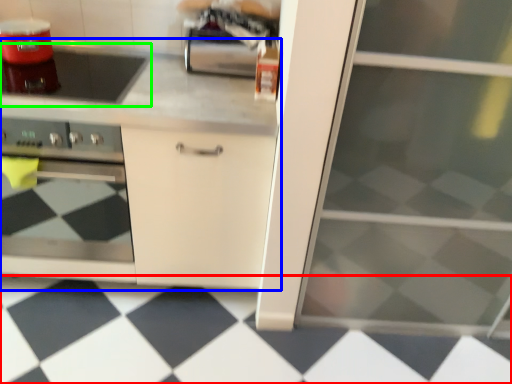
Question: Which is nearer to the tile (highlighted by a red box)? cabinetry (highlighted by a blue box) or gas stove (highlighted by a green box).

Choices:
 (A) cabinetry
 (B) gas stove

Answer: (A)